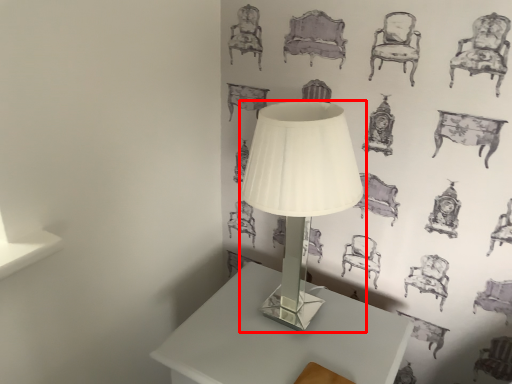
Question: Considering the relative positions of lamp (annotated by the red box) and table in the image provided, where is lamp (annotated by the red box) located with respect to the staircase?

Choices:
 (A) left
 (B) right

Answer: (B)